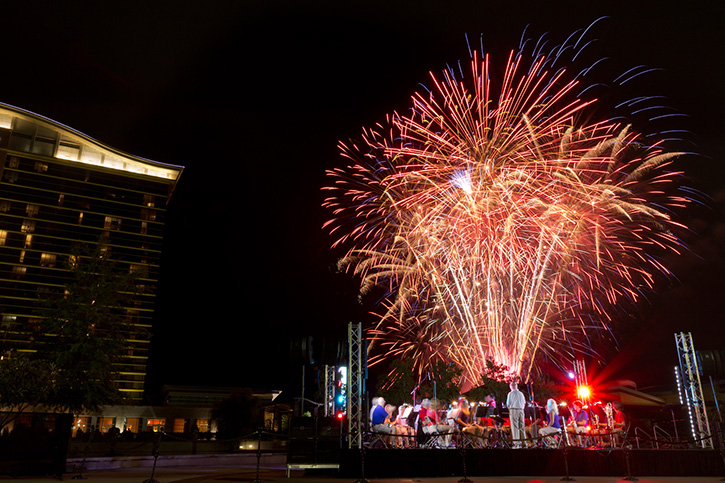
Find the location of `stage`. stage is located at coordinates (496, 459).